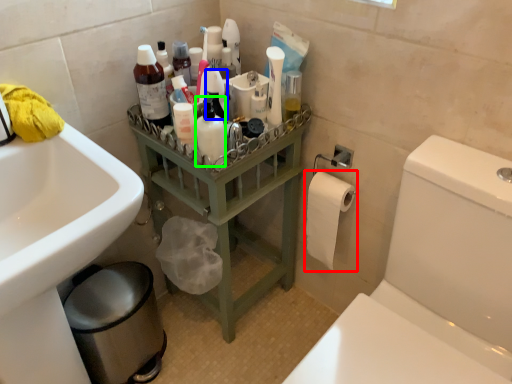
Question: Considering the real-world distances, which object is closest to toilet paper (highlighted by a red box)? cleaning product (highlighted by a blue box) or toiletry (highlighted by a green box).

Choices:
 (A) cleaning product
 (B) toiletry

Answer: (B)